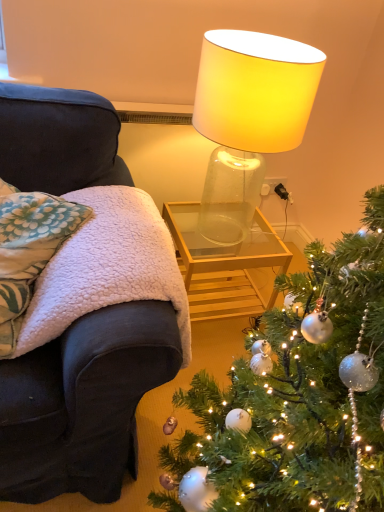
What do you see at coordinates (107, 267) in the screenshot?
I see `white fleece blanket at left` at bounding box center [107, 267].

The height and width of the screenshot is (512, 384). What do you see at coordinates (255, 90) in the screenshot?
I see `translucent glass lamp at upper center` at bounding box center [255, 90].

This screenshot has width=384, height=512. What do you see at coordinates (29, 249) in the screenshot? I see `fluffy white pillow at left` at bounding box center [29, 249].

This screenshot has height=512, width=384. Identify the location of white fleece blanket at left. (107, 267).

Is white fleece blanket at left aimed at fluffy white pillow at left?

No, white fleece blanket at left is not facing towards fluffy white pillow at left.

Considering the sizes of objects white fleece blanket at left and fluffy white pillow at left in the image provided, who is smaller, white fleece blanket at left or fluffy white pillow at left?

Smaller between the two is fluffy white pillow at left.

Measure the distance between white fleece blanket at left and fluffy white pillow at left.

4.38 inches.

From a real-world perspective, does white fleece blanket at left stand above fluffy white pillow at left?

Incorrect, from a real-world perspective, white fleece blanket at left is lower than fluffy white pillow at left.

Is fluffy white pillow at left outside of transparent glass table at center?

Absolutely, fluffy white pillow at left is external to transparent glass table at center.

Visually, is fluffy white pillow at left positioned to the left or to the right of transparent glass table at center?

From the image, it's evident that fluffy white pillow at left is to the left of transparent glass table at center.

Considering their positions, is fluffy white pillow at left located in front of or behind transparent glass table at center?

Visually, fluffy white pillow at left is located in front of transparent glass table at center.

From a real-world perspective, is fluffy white pillow at left below transparent glass table at center?

Incorrect, from a real-world perspective, fluffy white pillow at left is higher than transparent glass table at center.

What's the angular difference between translucent glass lamp at upper center and shiny silver ornaments at lower right's facing directions?

translucent glass lamp at upper center and shiny silver ornaments at lower right are facing 0.204 degrees away from each other.

Considering the positions of objects translucent glass lamp at upper center and shiny silver ornaments at lower right in the image provided, who is more to the right, translucent glass lamp at upper center or shiny silver ornaments at lower right?

From the viewer's perspective, shiny silver ornaments at lower right appears more on the right side.

Between translucent glass lamp at upper center and shiny silver ornaments at lower right, which one has more height?

shiny silver ornaments at lower right.

From a real-world perspective, is fluffy white pillow at left positioned above or below translucent glass lamp at upper center?

In terms of real-world spatial position, fluffy white pillow at left is below translucent glass lamp at upper center.

Could you tell me if fluffy white pillow at left is facing translucent glass lamp at upper center?

No.

Considering the sizes of fluffy white pillow at left and translucent glass lamp at upper center in the image, is fluffy white pillow at left wider or thinner than translucent glass lamp at upper center?

Considering their sizes, fluffy white pillow at left looks broader than translucent glass lamp at upper center.

From the image's perspective, relative to translucent glass lamp at upper center, is fluffy white pillow at left above or below?

fluffy white pillow at left is below translucent glass lamp at upper center.

From a real-world perspective, is translucent glass lamp at upper center physically located above or below fluffy white pillow at left?

translucent glass lamp at upper center is situated higher than fluffy white pillow at left in the real world.

Could you tell me if translucent glass lamp at upper center is turned towards fluffy white pillow at left?

Yes, translucent glass lamp at upper center is facing fluffy white pillow at left.

At what (x,y) coordinates should I click in order to perform the action: click on pillow below the translucent glass lamp at upper center (from the image's perspective). Please return your answer as a coordinate pair (x, y). This screenshot has width=384, height=512. Looking at the image, I should click on (29, 249).

Is translucent glass lamp at upper center not close to fluffy white pillow at left?

No.

From a real-world perspective, is transparent glass table at center on fluffy white pillow at left?

No, from a real-world perspective, transparent glass table at center is not above fluffy white pillow at left.

Considering the sizes of objects transparent glass table at center and fluffy white pillow at left in the image provided, who is wider, transparent glass table at center or fluffy white pillow at left?

Wider between the two is transparent glass table at center.

Is transparent glass table at center bigger or smaller than fluffy white pillow at left?

transparent glass table at center is bigger than fluffy white pillow at left.

Considering the sizes of objects fluffy white pillow at left and white fleece blanket at left in the image provided, who is taller, fluffy white pillow at left or white fleece blanket at left?

white fleece blanket at left is taller.

Between fluffy white pillow at left and white fleece blanket at left, which one is positioned in front?

Positioned in front is white fleece blanket at left.

Find the location of a particular element. This screenshot has width=384, height=512. pillow above the white fleece blanket at left (from a real-world perspective) is located at coordinates (29, 249).

Is fluffy white pillow at left thinner than white fleece blanket at left?

Yes.

Image resolution: width=384 pixels, height=512 pixels. In order to click on blanket below the fluffy white pillow at left (from a real-world perspective) in this screenshot , I will do `click(107, 267)`.

There is a transparent glass table at center. Where is `pillow above it (from a real-world perspective)`? The width and height of the screenshot is (384, 512). pillow above it (from a real-world perspective) is located at coordinates (29, 249).

Looking at the image, which one is located closer to fluffy white pillow at left, translucent glass lamp at upper center or transparent glass table at center?

translucent glass lamp at upper center is closer to fluffy white pillow at left.

Considering their positions, is translucent glass lamp at upper center positioned further to transparent glass table at center than fluffy white pillow at left?

The object further to transparent glass table at center is fluffy white pillow at left.

Considering their positions, is white fleece blanket at left positioned closer to shiny silver ornaments at lower right than transparent glass table at center?

white fleece blanket at left.

When comparing their distances from translucent glass lamp at upper center, does transparent glass table at center or white fleece blanket at left seem further?

transparent glass table at center is positioned further to the anchor translucent glass lamp at upper center.

Estimate the real-world distances between objects in this image. Which object is further from fluffy white pillow at left, white fleece blanket at left or shiny silver ornaments at lower right?

shiny silver ornaments at lower right lies further to fluffy white pillow at left than the other object.

When comparing their distances from white fleece blanket at left, does shiny silver ornaments at lower right or transparent glass table at center seem closer?

shiny silver ornaments at lower right is closer to white fleece blanket at left.

Considering their positions, is shiny silver ornaments at lower right positioned closer to fluffy white pillow at left than white fleece blanket at left?

white fleece blanket at left is closer to fluffy white pillow at left.

When comparing their distances from fluffy white pillow at left, does shiny silver ornaments at lower right or translucent glass lamp at upper center seem further?

shiny silver ornaments at lower right lies further to fluffy white pillow at left than the other object.

The width and height of the screenshot is (384, 512). Find the location of `blanket positioned between shiny silver ornaments at lower right and translucent glass lamp at upper center from near to far`. blanket positioned between shiny silver ornaments at lower right and translucent glass lamp at upper center from near to far is located at coordinates (107, 267).

Where is `pillow between white fleece blanket at left and transparent glass table at center along the z-axis`? This screenshot has height=512, width=384. pillow between white fleece blanket at left and transparent glass table at center along the z-axis is located at coordinates (29, 249).

At what (x,y) coordinates should I click in order to perform the action: click on pillow between shiny silver ornaments at lower right and translucent glass lamp at upper center from front to back. Please return your answer as a coordinate pair (x, y). Looking at the image, I should click on (29, 249).

Find the location of a particular element. blanket between shiny silver ornaments at lower right and transparent glass table at center along the z-axis is located at coordinates [x=107, y=267].